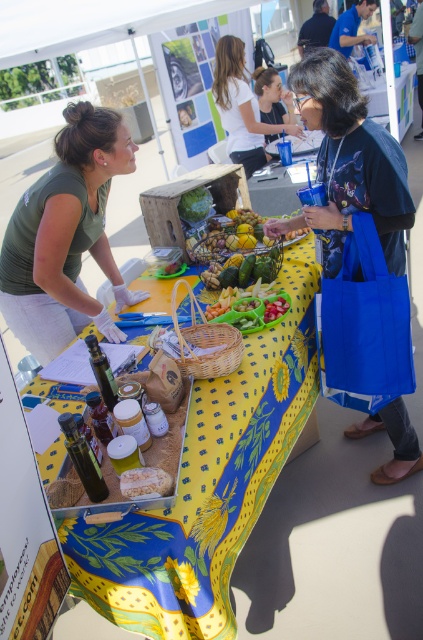
Is smooth plastic tray at center positioned before green leafy vegetable at center?

Yes.

Is smooth plastic tray at center smaller than green leafy vegetable at center?

No.

Locate an element on the screen. smooth plastic tray at center is located at coordinates (252, 307).

Which of these two, dark blue fabric bag at center or white cotton shirt at upper center, stands shorter?

Standing shorter between the two is dark blue fabric bag at center.

Which is behind, point (337, 246) or point (258, 166)?

Point (258, 166)

Find the location of a particular element. dark blue fabric bag at center is located at coordinates (348, 163).

Does yellow printed fabric at center appear on the left side of green matte shirt at upper left?

In fact, yellow printed fabric at center is to the right of green matte shirt at upper left.

Is point (77, 576) less distant than point (62, 348)?

Yes, point (77, 576) is in front of point (62, 348).

At what (x,y) coordinates should I click in order to perform the action: click on yellow printed fabric at center. Please return your answer as a coordinate pair (x, y). Looking at the image, I should click on (208, 484).